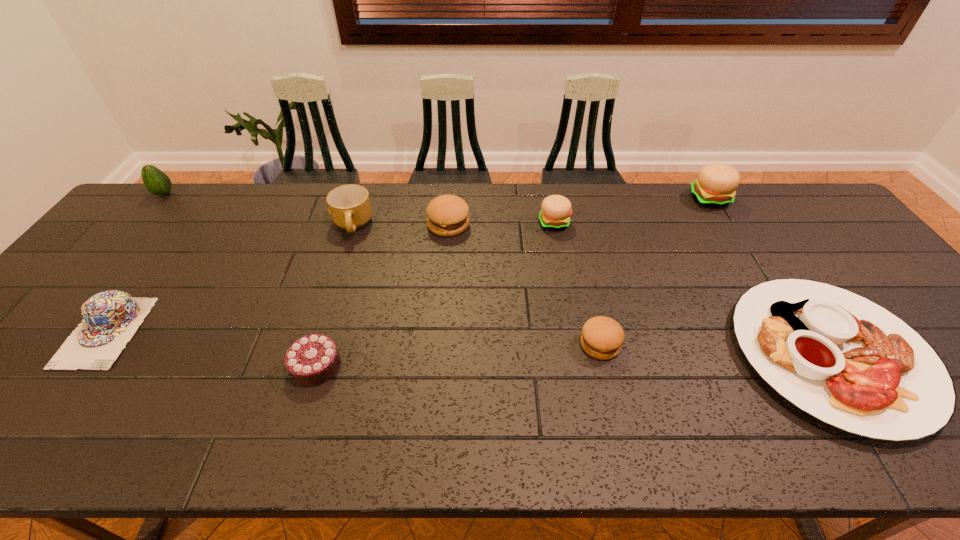
Find the location of a particular element. The height and width of the screenshot is (540, 960). chocolate chocolate cake is located at coordinates pos(312,360).

This screenshot has width=960, height=540. I want to click on the right brown hamburger, so click(602, 337).

The height and width of the screenshot is (540, 960). I want to click on the smaller brown hamburger, so click(602, 337).

You are a GUI agent. You are given a task and a screenshot of the screen. Output one action in this format:
    pyautogui.click(x=<x>, y=<y>)
    Task: Click on the vacant space situated 0.360m on the left of the bigger beige hamburger
    The image size is (960, 540).
    Given the screenshot: What is the action you would take?
    pyautogui.click(x=581, y=199)

Find the location of a particular element. This screenshot has height=540, width=960. vacant region located on the front of the avocado is located at coordinates (143, 220).

The height and width of the screenshot is (540, 960). I want to click on vacant region located on the side with the handle of the tan mug, so click(339, 269).

This screenshot has width=960, height=540. Find the location of `free space located 0.290m on the left of the farther brown hamburger`. free space located 0.290m on the left of the farther brown hamburger is located at coordinates (333, 225).

At what (x,y) coordinates should I click in order to perform the action: click on blank area located 0.310m on the front of the smaller beige hamburger. Please return your answer as a coordinate pair (x, y). This screenshot has width=960, height=540. Looking at the image, I should click on (570, 312).

You are a GUI agent. You are given a task and a screenshot of the screen. Output one action in this format:
    pyautogui.click(x=<x>, y=<y>)
    Task: Click on the vacant region located 0.080m on the front, side, and top of the second object from left to right
    
    Given the screenshot: What is the action you would take?
    pyautogui.click(x=54, y=403)

Where is `blank space located on the left of the chocolate cake`? This screenshot has height=540, width=960. blank space located on the left of the chocolate cake is located at coordinates (135, 366).